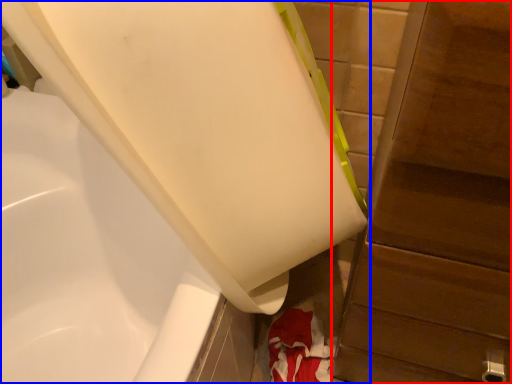
Question: Which object appears closest to the camera in this image, dresser (highlighted by a red box) or bathtub (highlighted by a blue box)?

Choices:
 (A) dresser
 (B) bathtub

Answer: (A)